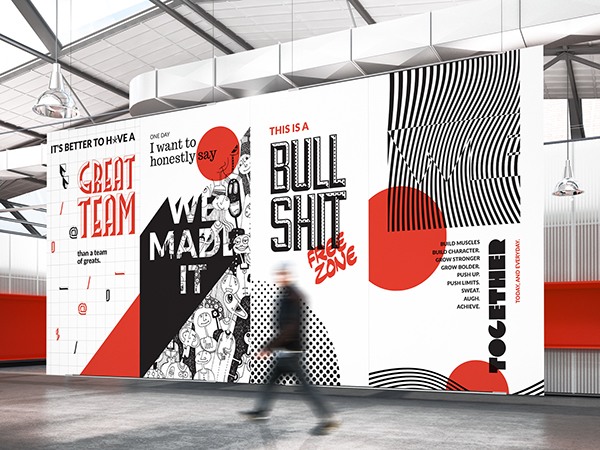
Locate an element on the screen. This screenshot has width=600, height=450. red wall is located at coordinates (25, 323), (578, 326).